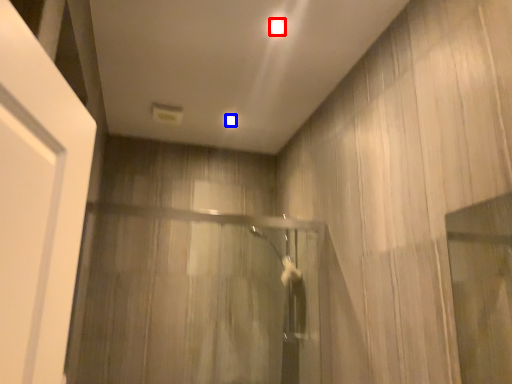
Question: Which object is closer to the camera taking this photo, lighting (highlighted by a red box) or lighting (highlighted by a blue box)?

Choices:
 (A) lighting
 (B) lighting

Answer: (A)